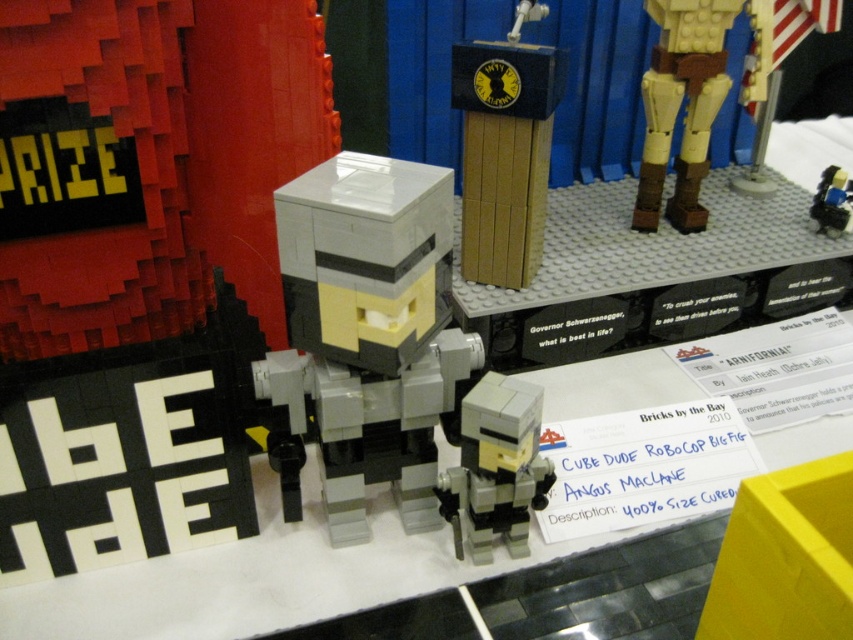
Question: Does tan/leather-likerobot leg at right have a lesser width compared to yellow plastic flag at upper right?

Choices:
 (A) no
 (B) yes

Answer: (B)

Question: Which of the following is the farthest from the observer?

Choices:
 (A) matte black figure at center
 (B) yellow plastic flag at upper right
 (C) gray matte figure at center
 (D) tan/leather-likerobot leg at right

Answer: (A)

Question: Does wooden podium at center lie behind yellow plastic flag at upper right?

Choices:
 (A) no
 (B) yes

Answer: (A)

Question: Which object is farther from the camera taking this photo?

Choices:
 (A) white matte robocop at center
 (B) tan/leather-likerobot leg at right

Answer: (B)

Question: Which of the following is the farthest from the observer?

Choices:
 (A) (685, 204)
 (B) (764, 90)
 (C) (473, 394)

Answer: (A)

Question: In this image, where is white matte robocop at center located relative to yellow plastic flag at upper right?

Choices:
 (A) below
 (B) above

Answer: (A)